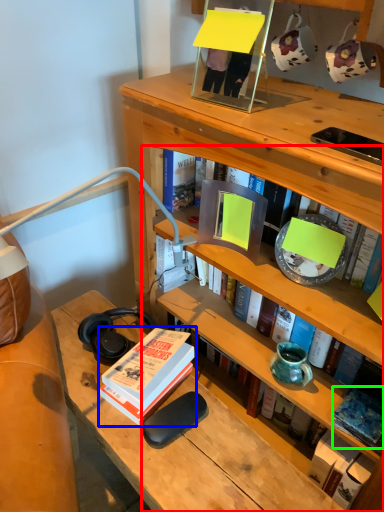
Question: Which is nearer to the book (highlighted by a red box)? book (highlighted by a blue box) or book (highlighted by a green box).

Choices:
 (A) book
 (B) book

Answer: (A)